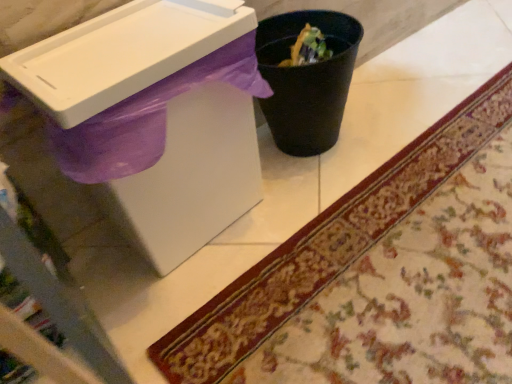
Find the location of a particular element. This screenshot has width=512, height=384. vacant area that lies to the right of black plastic trash can at center is located at coordinates (406, 111).